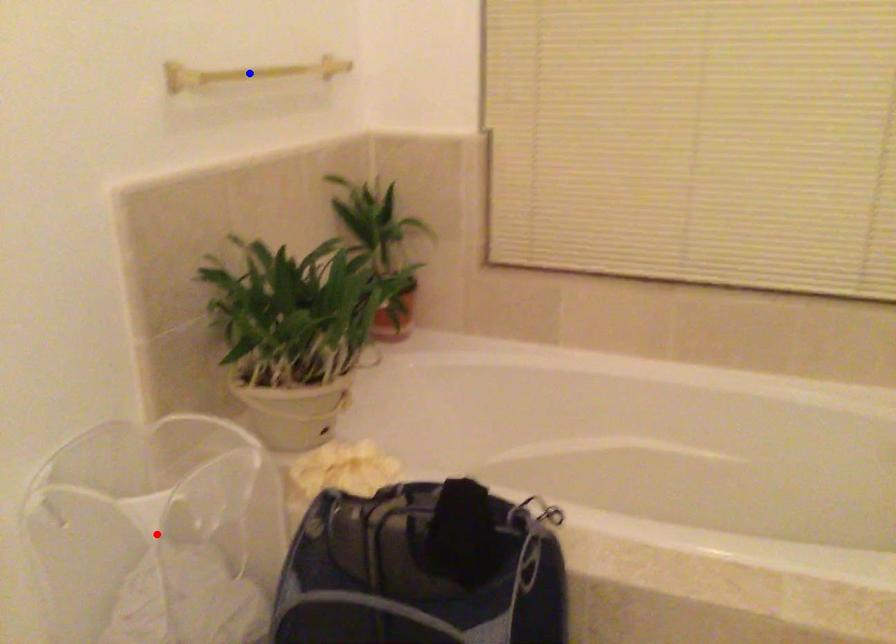
Question: Which of the two points in the image is closer to the camera?

Choices:
 (A) Blue point is closer.
 (B) Red point is closer.

Answer: (B)